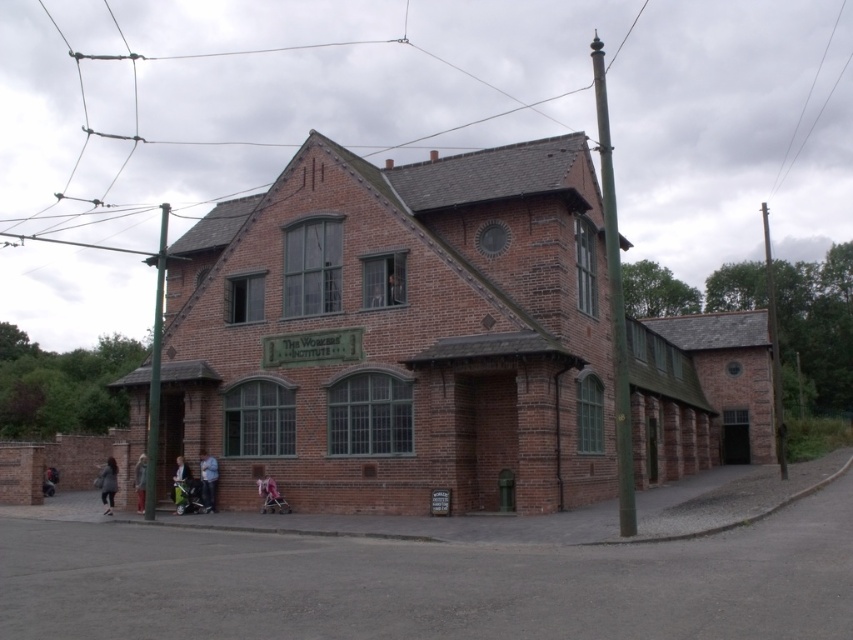
You are standing at point (775, 352) and want to move towards the brown wooden pole at right. Which direction should you go?

The brown wooden pole at right is located at point (775, 352), so you are already at the same location as the brown wooden pole at right. Therefore, no movement is needed.

You are standing in front of the brick building and see a light pink fabric stroller at lower center and a light brown leather jacket at lower center. Which object is closer to you?

The light pink fabric stroller at lower center is closer to you because it is in front of the light brown leather jacket at lower center.